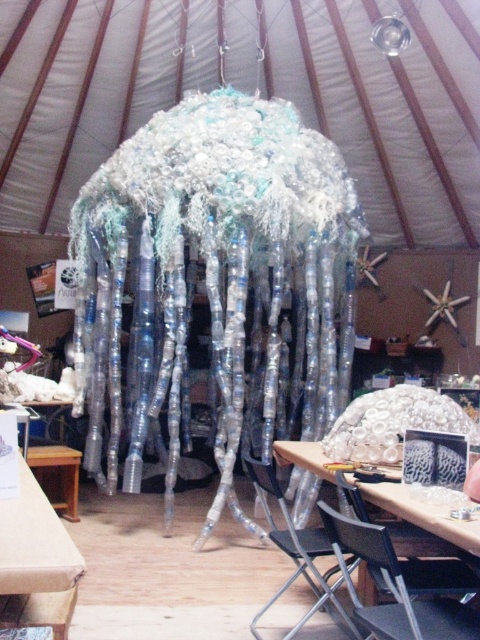
You are an artist standing at point (297,550) in the workshop. You need to move to the metallic silver chair at lower center. Is the path clear? Please explain.

The path between your current position at point (297,550) and the metallic silver chair at lower center is clear since there are no objects blocking the way according to the scene description.

You are a person who wants to sit down in the workshop. You see a black plastic chair at lower center and a metallic silver chair at lower center. Which chair is positioned higher from the ground?

The black plastic chair at lower center is located above the metallic silver chair at lower center, so it is positioned higher from the ground.

You are a visitor in this workshop and want to sit down. You see a metallic silver chair at lower center and a wooden table at lower left. Which seat is taller?

The metallic silver chair at lower center is much taller than the wooden table at lower left, so the metallic silver chair at lower center is taller.